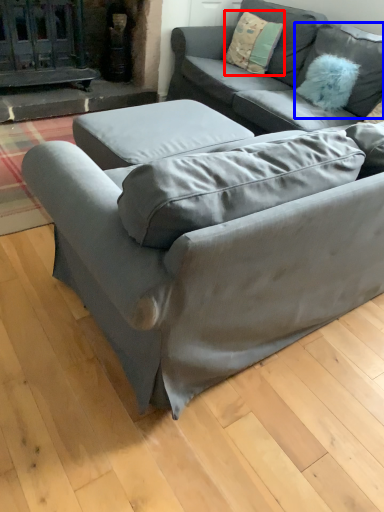
Question: Which object is closer to the camera taking this photo, pillow (highlighted by a red box) or pillow (highlighted by a blue box)?

Choices:
 (A) pillow
 (B) pillow

Answer: (B)